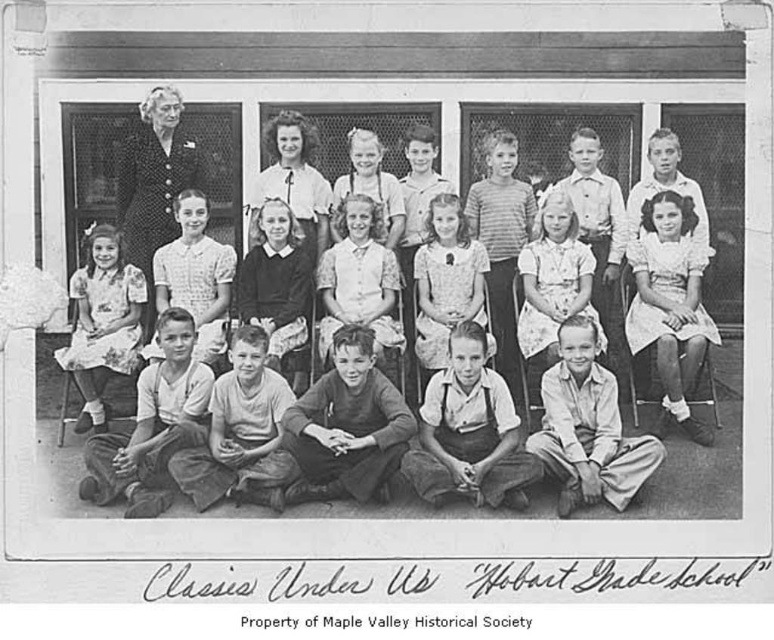
Question: Which point appears farthest from the camera in this image?

Choices:
 (A) (x=163, y=109)
 (B) (x=649, y=376)
 (C) (x=122, y=349)

Answer: (A)

Question: Observing the image, what is the correct spatial positioning of light pink dress at center in reference to floral dress at center?

Choices:
 (A) right
 (B) left

Answer: (A)

Question: Which point is farther to the camera?

Choices:
 (A) floral dress at center
 (B) dark fabric suit at upper left

Answer: (B)

Question: Does light pink dress at center appear on the right side of floral dress at center?

Choices:
 (A) yes
 (B) no

Answer: (A)

Question: Considering the relative positions of light pink dress at center and dark fabric suit at upper left in the image provided, where is light pink dress at center located with respect to dark fabric suit at upper left?

Choices:
 (A) right
 (B) left

Answer: (A)

Question: Which of these objects is positioned closest to the dark fabric suit at upper left?

Choices:
 (A) floral dress at center
 (B) light pink dress at center

Answer: (A)